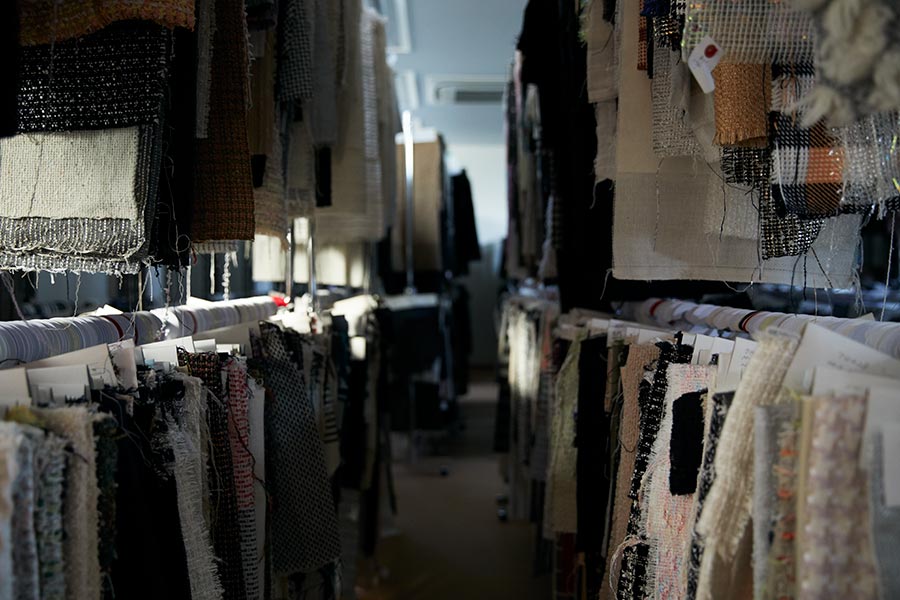
The height and width of the screenshot is (600, 900). I want to click on clothes rack, so click(x=63, y=337), click(x=231, y=309), click(x=687, y=311).